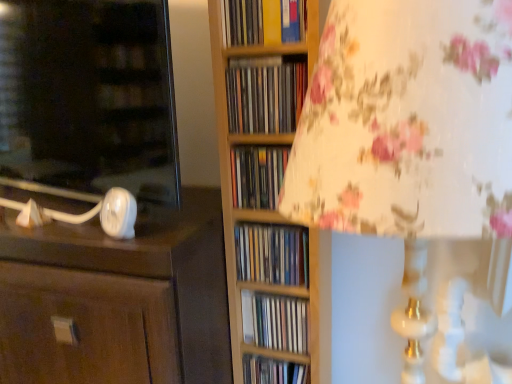
Question: Considering the positions of matte plastic books at center, which appears as the 4th book when viewed from the top, and matte plastic books at center, placed as the 3th book when sorted from top to bottom, in the image, is matte plastic books at center, which appears as the 4th book when viewed from the top, taller or shorter than matte plastic books at center, placed as the 3th book when sorted from top to bottom,?

Choices:
 (A) tall
 (B) short

Answer: (A)

Question: From the image's perspective, relative to matte plastic books at center, the 4th book from the bottom, is matte plastic books at center, which appears as the 4th book when viewed from the top, above or below?

Choices:
 (A) above
 (B) below

Answer: (B)

Question: Which is farther from the wooden cd case at center, the fifth book in the bottom-to-top sequence?

Choices:
 (A) matte plastic books at center, placed as the 3th book when sorted from top to bottom
 (B) matte brown cabinet at left
 (C) matte plastic books at center, which ranks as the sixth book in top-to-bottom order
 (D) matte white lamp base at left
 (E) matte plastic books at center, which appears as the 3th book when ordered from the bottom

Answer: (C)

Question: Estimate the real-world distances between objects in this image. Which object is farther from the matte plastic books at center, which ranks as the sixth book in top-to-bottom order?

Choices:
 (A) wooden cd case at center, the fifth book in the bottom-to-top sequence
 (B) matte plastic books at center, which appears as the 4th book when viewed from the top
 (C) matte white lamp base at left
 (D) matte plastic books at center, the 4th book from the bottom
 (E) yellow paperback book at upper center, acting as the sixth book starting from the bottom

Answer: (E)